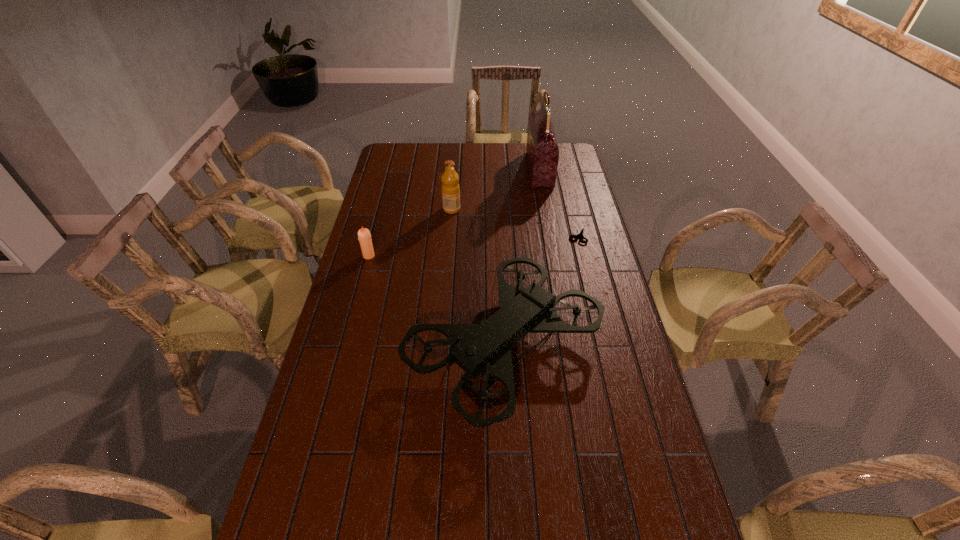
At what (x,y) coordinates should I click in order to perform the action: click on free space in the image that satisfies the following two spatial constraints: 1. on the back side of the drone; 2. on the left side of the third nearest object. Please return your answer as a coordinate pair (x, y). Looking at the image, I should click on (499, 236).

Image resolution: width=960 pixels, height=540 pixels. I want to click on free spot that satisfies the following two spatial constraints: 1. on the front label of the nearest object; 2. on the left side of the fruit juice, so click(x=442, y=347).

At what (x,y) coordinates should I click in order to perform the action: click on free space that satisfies the following two spatial constraints: 1. on the front label of the third shortest object; 2. on the left side of the shears. Please return your answer as a coordinate pair (x, y). The height and width of the screenshot is (540, 960). Looking at the image, I should click on (449, 236).